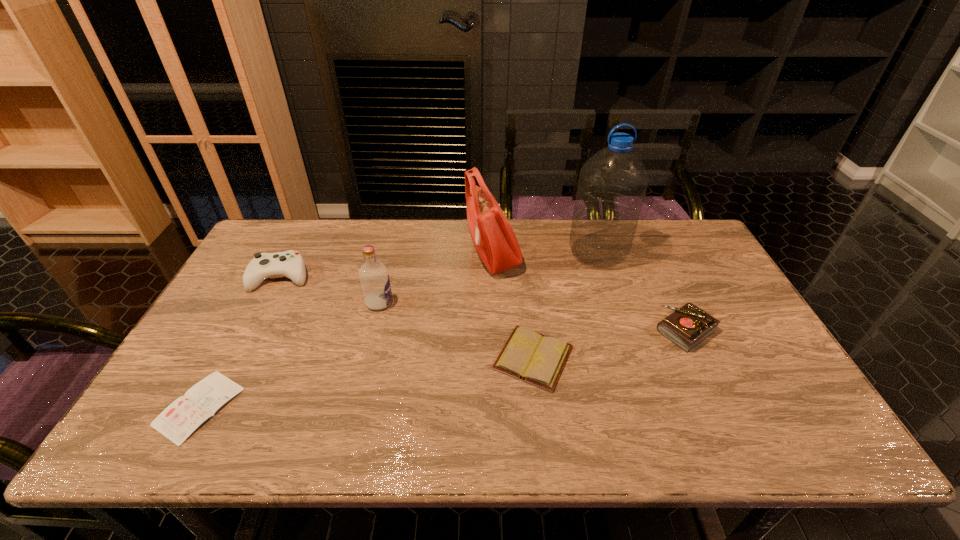
Where is `the tallest object`? the tallest object is located at coordinates (612, 186).

Locate an element on the screen. This screenshot has height=540, width=960. the second tallest object is located at coordinates (494, 239).

I want to click on vodka, so click(x=373, y=275).

Identify the location of the fifth object from right to left. (373, 275).

Locate an element on the screen. the fourth shortest object is located at coordinates (290, 264).

Identify the location of the tallest diary. The height and width of the screenshot is (540, 960). (688, 326).

Where is `the third shortest object`? the third shortest object is located at coordinates (688, 326).

This screenshot has height=540, width=960. I want to click on the sixth tallest object, so click(529, 356).

Locate an element on the screen. This screenshot has width=960, height=540. the second tallest diary is located at coordinates (529, 356).

This screenshot has width=960, height=540. I want to click on the shortest object, so click(181, 418).